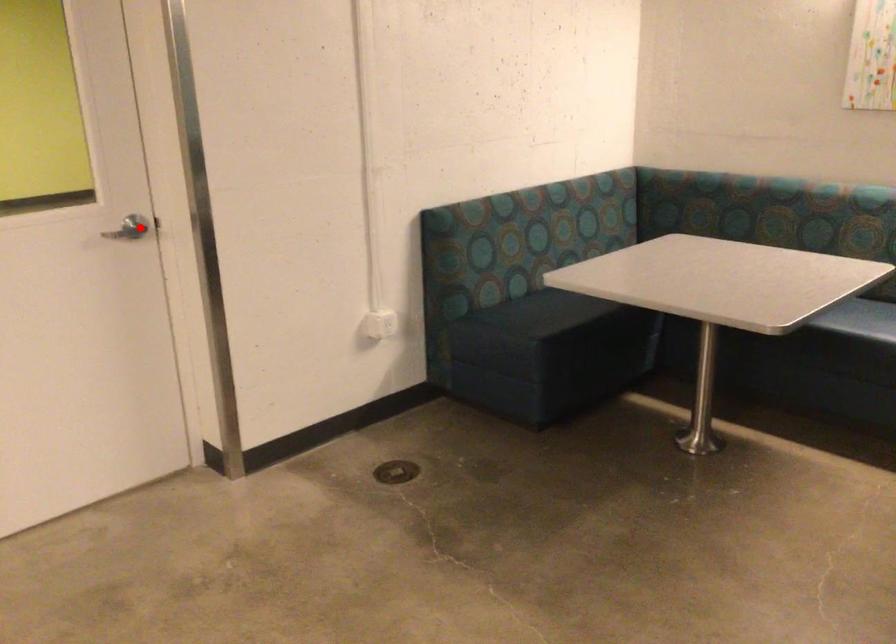
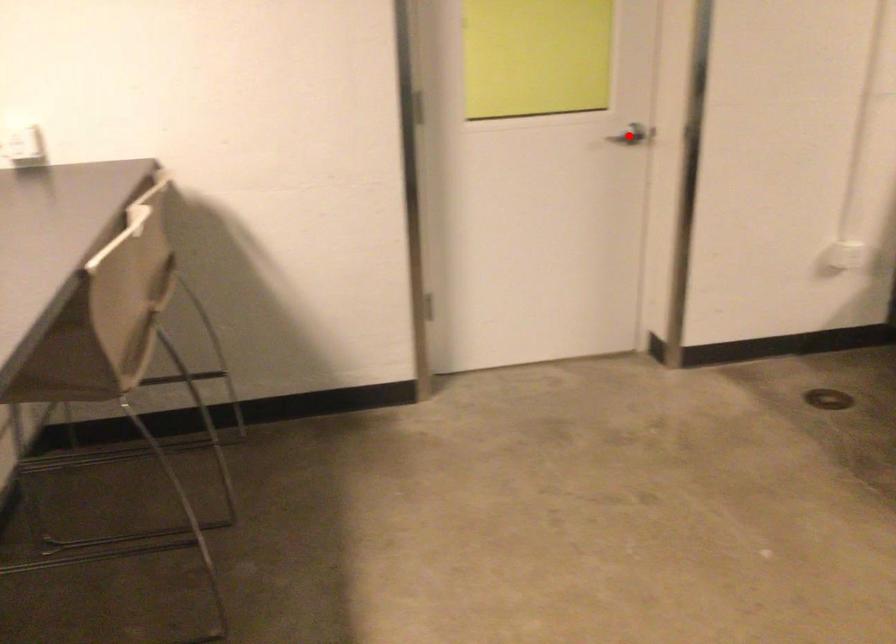
I am providing you with two images of the same scene from different viewpoints. A red point is marked on the first image and another point is marked on the second image. Are the points marked in image1 and image2 representing the same 3D position?

Yes